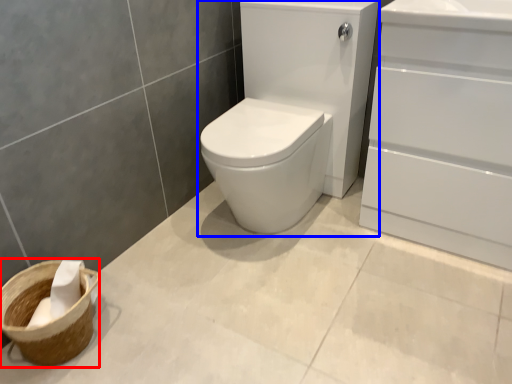
Question: Among these objects, which one is farthest to the camera, basket container (highlighted by a red box) or sink (highlighted by a blue box)?

Choices:
 (A) basket container
 (B) sink

Answer: (A)